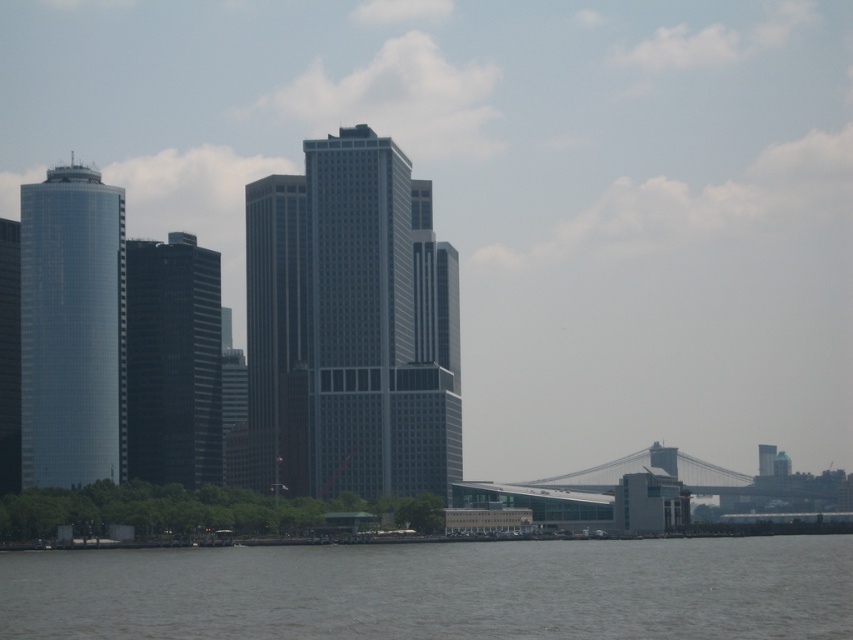
You are standing on the shore of the river and want to take a photo of the gray glass skyscraper at center. If your camera can only focus on objects within a 0.4 to 0.6 range on the x and y coordinates, will the skyscraper be in focus?

The gray glass skyscraper at center is located at coordinates (351, 326). Since both values fall within the 0.4 to 0.6 range, the skyscraper will be in focus.

You are a tourist standing on the waterfront and want to take a photo that includes both the gray glass skyscraper at center and the shiny glass tower at left. Based on their positions, which building should you position closer to the left side of your camera frame to include both in the shot?

To include both the gray glass skyscraper at center and the shiny glass tower at left in your photo, you should position the shiny glass tower at left closer to the left side of your camera frame since the gray glass skyscraper at center is to the right of it.